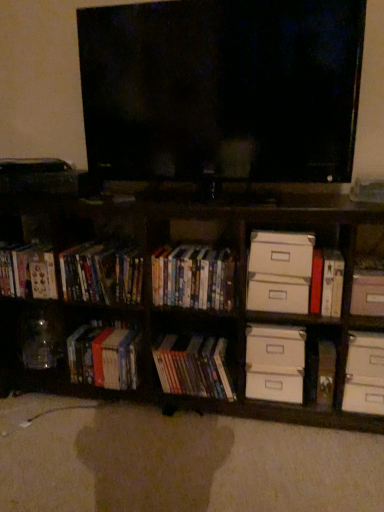
The width and height of the screenshot is (384, 512). I want to click on free point above hardcover books at left, the 2th book from the left (from a real-world perspective), so click(x=110, y=323).